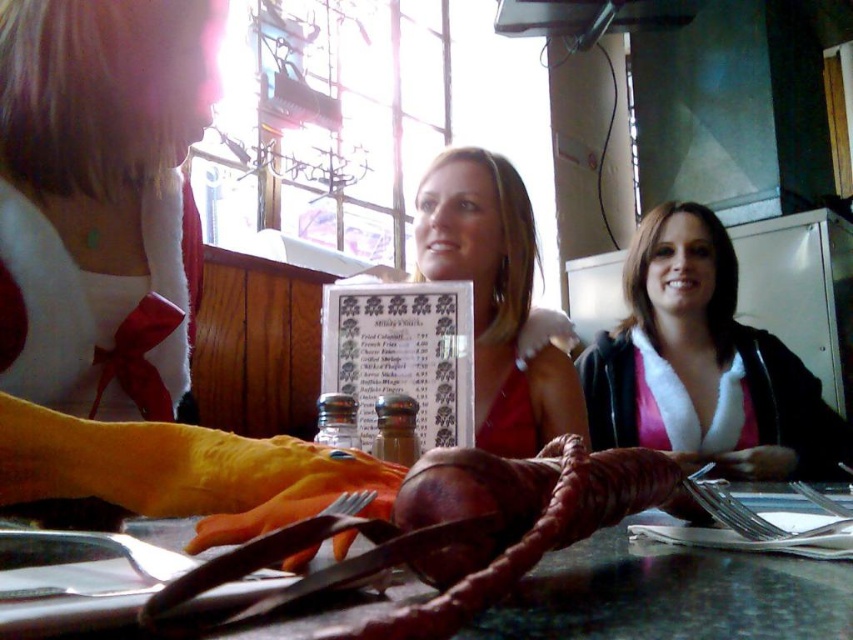
You are a waiter holding a tray of drinks and need to reach the table where the two women are sitting. There is a point at coordinates point (785, 568) that you must avoid stepping on because it is a wet floor sign. Can you safely navigate around it without getting too close? The distance between you and the point must be at least 50 centimeters for safety.

The point at coordinates point (785, 568) is only 45.18 centimeters away from the viewer, which is less than the required 50 centimeters safety distance. Therefore, you cannot safely navigate around it without getting too close.

You are a photographer trying to capture the perfect shot of the matte red dress at center. The camera is set up at the origin point. Which direction should you move the camera to align with the dress?

The 2D location of the matte red dress at center is at point 0.469 on the x axis and 0.583 on the y axis. To align the camera at the origin point, you should move the camera to the right along the x axis and upwards along the y axis to reach the coordinates of the matte red dress at center.